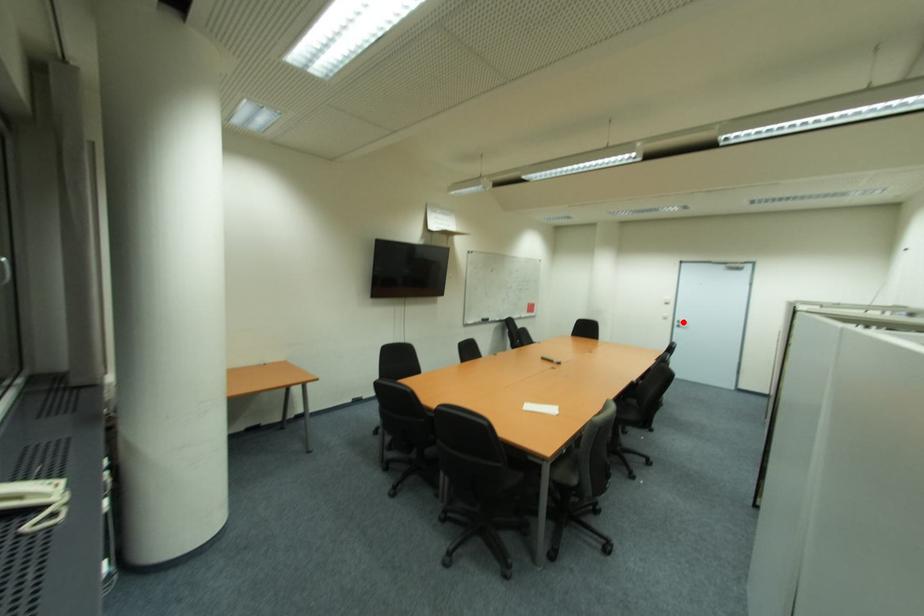
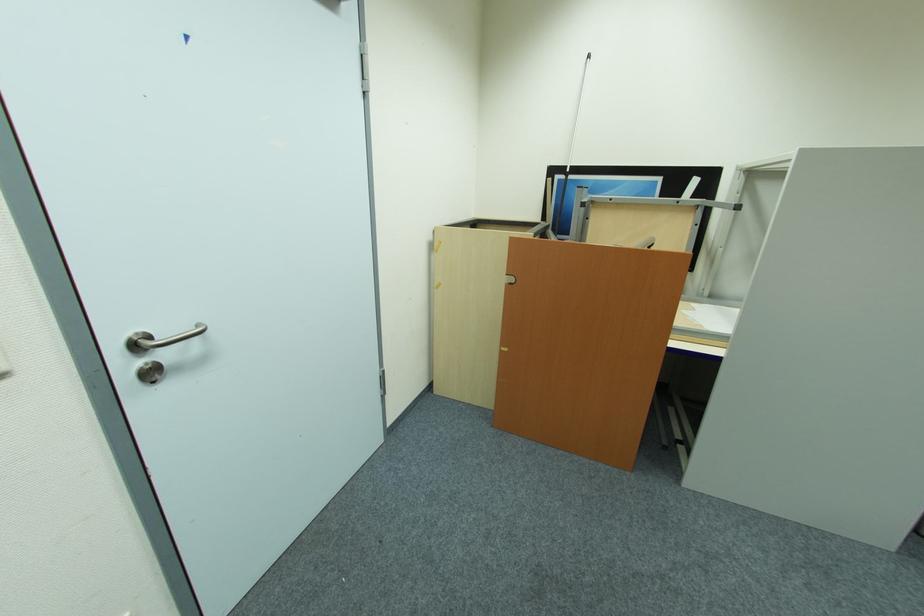
The point at the highlighted location is marked in the first image. Where is the corresponding point in the second image?

(141, 347)